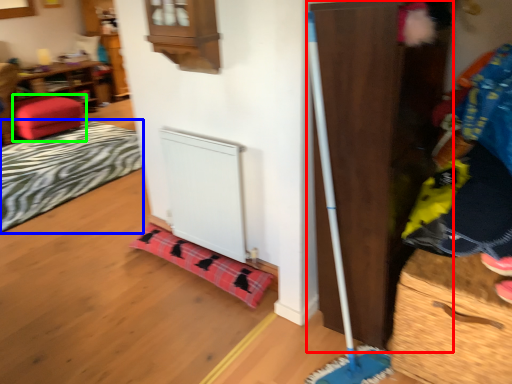
Question: Which is farther away from dresser (highlighted by a red box)? blanket (highlighted by a blue box) or furniture (highlighted by a green box)?

Choices:
 (A) blanket
 (B) furniture

Answer: (B)